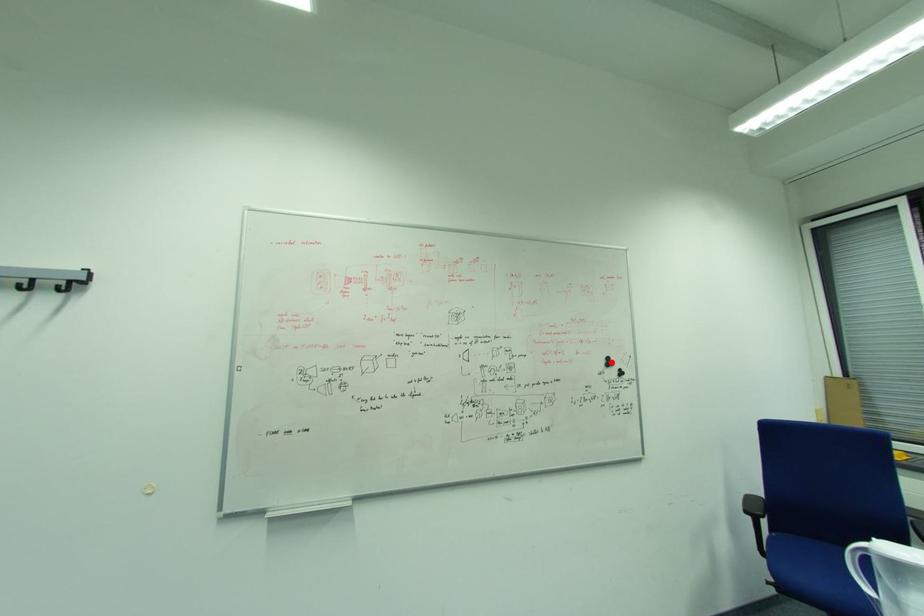
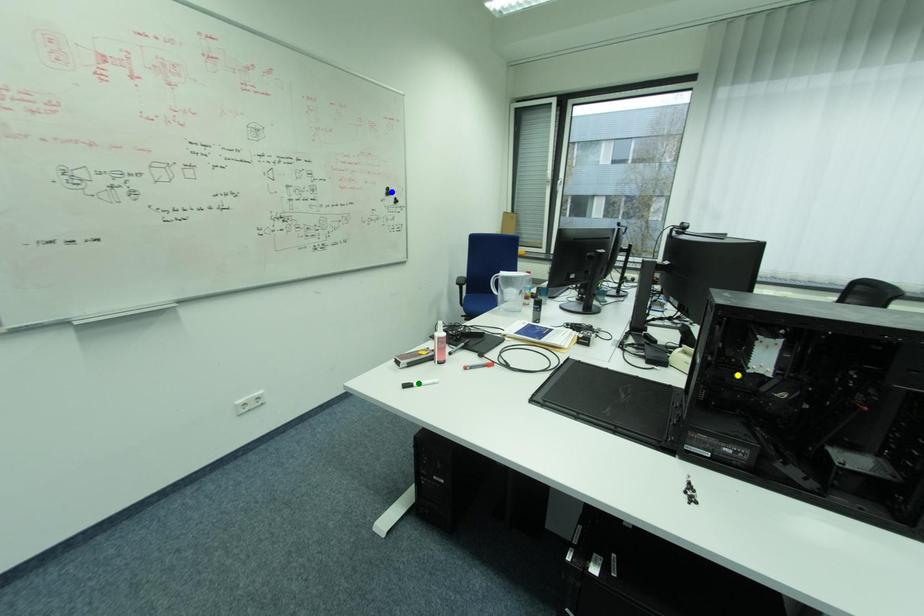
Question: I am providing you with two images of the same scene from different viewpoints. A red point is marked on the first image. You are given multiple points on the second image. In image 2, which mark is for the same physical point as the one in image 1?

Choices:
 (A) green point
 (B) blue point
 (C) yellow point

Answer: (B)